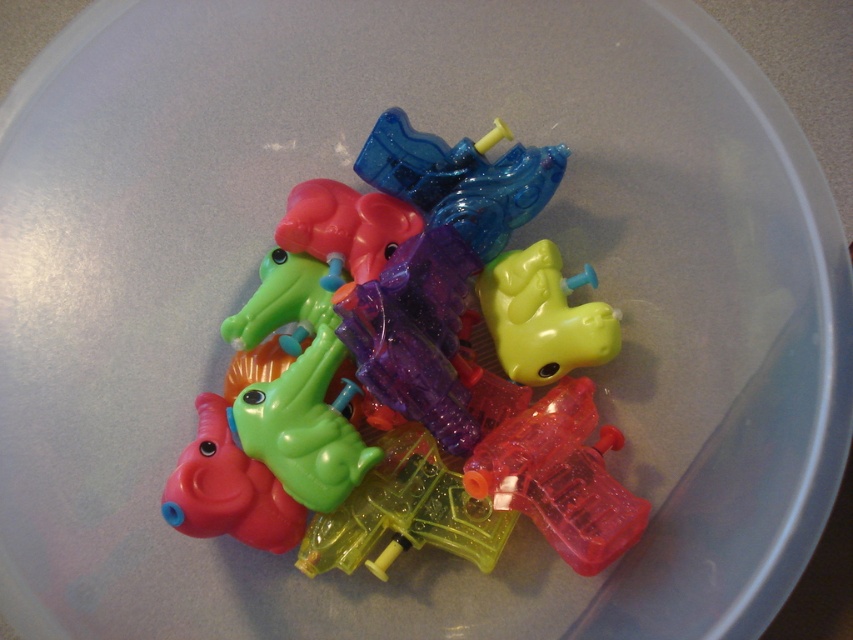
Is transparent plastic gun at center closer to the viewer compared to rubberized green crocodile at center?

Yes, it is.

From the picture: Is transparent plastic gun at center wider than rubberized green crocodile at center?

Yes.

Find the location of a particular element. transparent plastic gun at center is located at coordinates (560, 477).

This screenshot has height=640, width=853. In order to click on transparent plastic gun at center in this screenshot , I will do `click(560, 477)`.

Which of these two, translucent plastic toy at center or rubberized green crocodile at center, stands taller?

Standing taller between the two is translucent plastic toy at center.

Between translucent plastic toy at center and rubberized green crocodile at center, which one is positioned lower?

Positioned lower is rubberized green crocodile at center.

Which is behind, point (587, 515) or point (190, 481)?

The point (190, 481) is more distant.

The height and width of the screenshot is (640, 853). I want to click on translucent plastic toy at center, so click(412, 355).

Which is below, translucent plastic toy at center or transparent plastic gun at center?

transparent plastic gun at center

Is point (386, 403) farther from camera compared to point (596, 465)?

That is True.

Does point (532, 506) come in front of point (642, 512)?

No, (532, 506) is behind (642, 512).

This screenshot has width=853, height=640. Identify the location of translucent plastic toy at center. (412, 355).